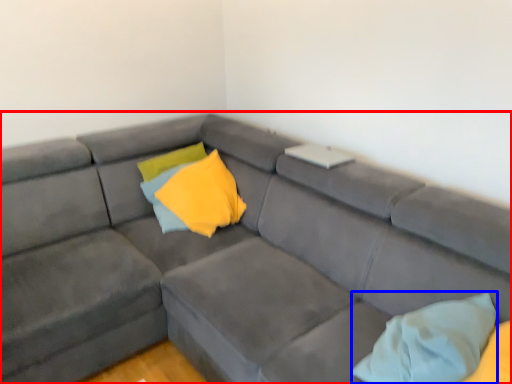
Question: Which of the following is the closest to the observer, studio couch (highlighted by a red box) or pillow (highlighted by a blue box)?

Choices:
 (A) studio couch
 (B) pillow

Answer: (A)